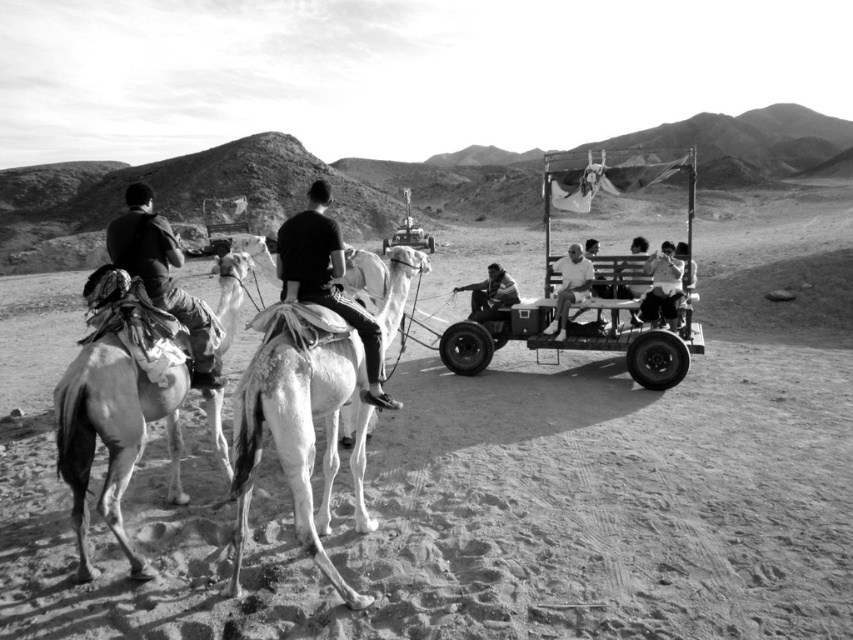
Question: Can you confirm if white matte camel at center is positioned to the right of light brown textured camel at left?

Choices:
 (A) yes
 (B) no

Answer: (A)

Question: Is the position of white matte camel at center less distant than that of smooth leather jacket at center?

Choices:
 (A) yes
 (B) no

Answer: (A)

Question: Is metallic cart at center to the right of light brown textured camel at left from the viewer's perspective?

Choices:
 (A) yes
 (B) no

Answer: (A)

Question: Estimate the real-world distances between objects in this image. Which object is closer to the smooth wooden bench at center?

Choices:
 (A) dark gray fabric camel at center
 (B) white matte camel at center
 (C) smooth leather jacket at center
 (D) dark fabric jacket at left

Answer: (C)

Question: Which point is closer to the camera?

Choices:
 (A) (469, 289)
 (B) (390, 256)
 (C) (369, 344)

Answer: (C)

Question: Which object appears closest to the camera in this image?

Choices:
 (A) dark fabric jacket at left
 (B) light brown textured camel at left
 (C) white matte camel at center
 (D) smooth leather jacket at center

Answer: (C)